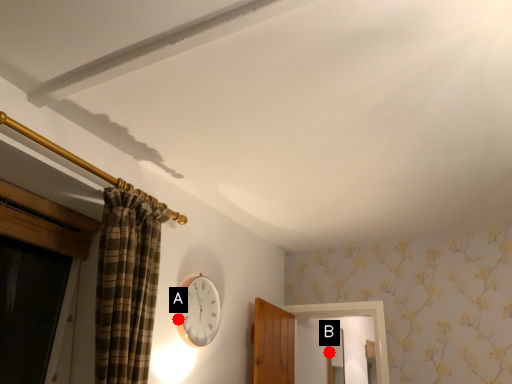
Question: Two points are circled on the image, labeled by A and B beside each circle. Which point is farther from the camera taking this photo?

Choices:
 (A) A is further
 (B) B is further

Answer: (B)